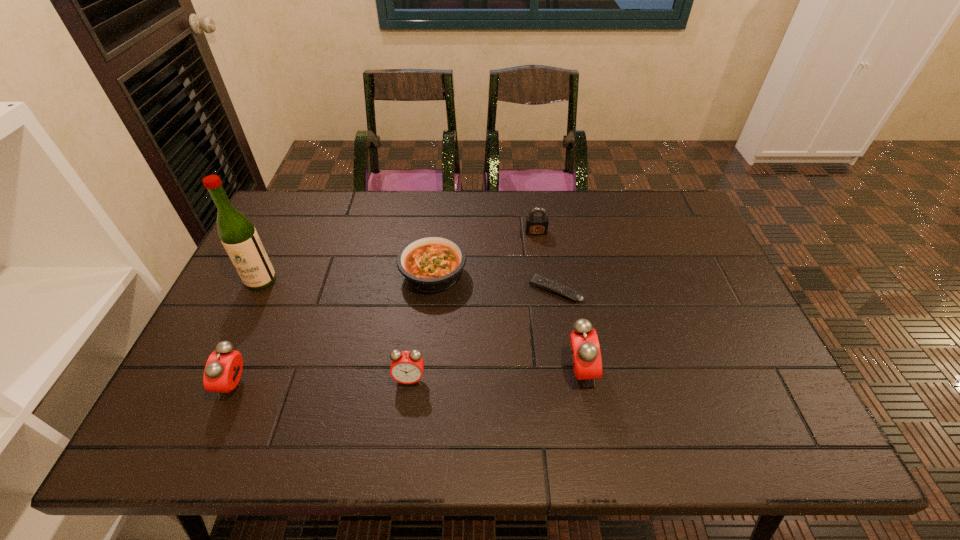
Please show where to add a alarm clock on the right while keeping spacing even. Please provide its 2D coordinates. Your answer should be formatted as a tuple, i.e. [(x, y)], where the tuple contains the x and y coordinates of a point satisfying the conditions above.

[(747, 366)]